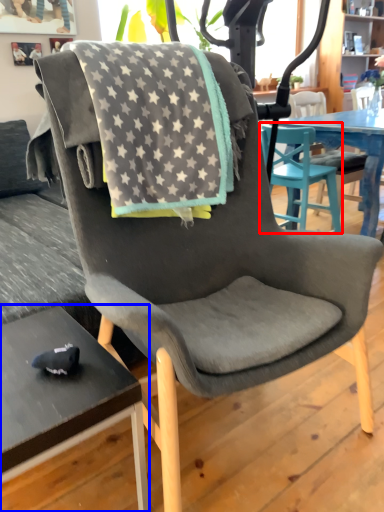
Question: Which object is further to the camera taking this photo, chair (highlighted by a red box) or desk (highlighted by a blue box)?

Choices:
 (A) chair
 (B) desk

Answer: (A)